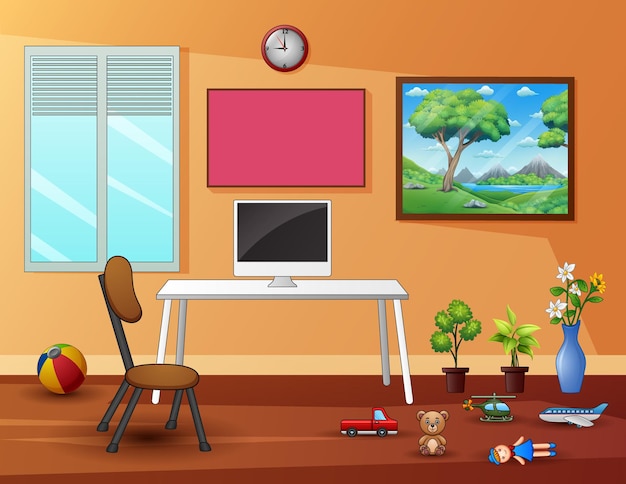
This screenshot has height=484, width=626. What are the coordinates of `teddy bear toy` in the screenshot? It's located at (427, 441).